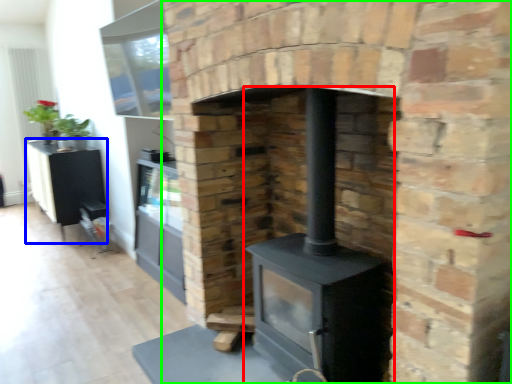
Question: Estimate the real-world distances between objects in this image. Which object is farther from wood burning stove (highlighted by a red box), entertainment center (highlighted by a blue box) or fireplace (highlighted by a green box)?

Choices:
 (A) entertainment center
 (B) fireplace

Answer: (A)